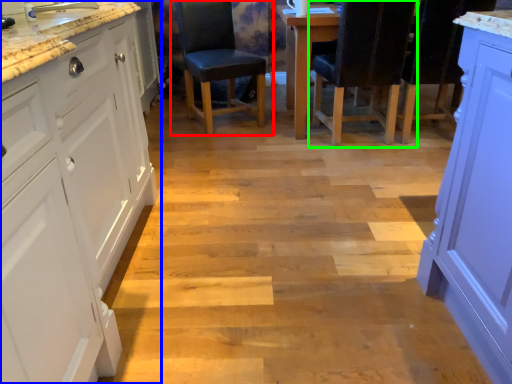
Question: Based on their relative distances, which object is farther from chair (highlighted by a red box)? Choose from cabinetry (highlighted by a blue box) and chair (highlighted by a green box).

Choices:
 (A) cabinetry
 (B) chair

Answer: (A)